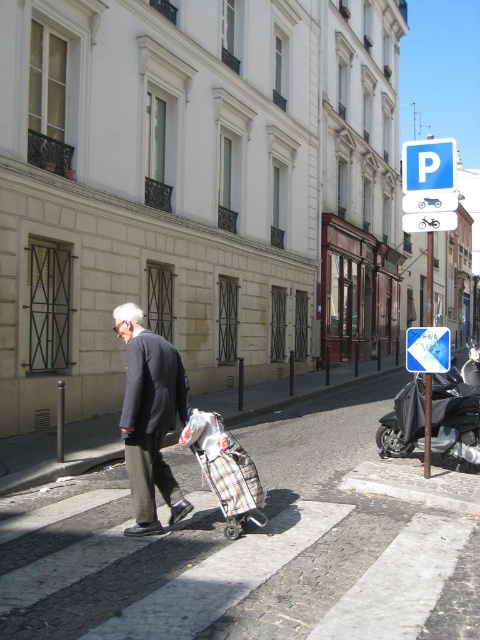
Who is higher up, blue plastic parking sign at upper right or blue plastic arrow at upper right?

blue plastic parking sign at upper right is higher up.

The width and height of the screenshot is (480, 640). Find the location of `blue plastic parking sign at upper right`. blue plastic parking sign at upper right is located at coordinates (429, 164).

At what (x,y) coordinates should I click in order to perform the action: click on blue plastic parking sign at upper right. Please return your answer as a coordinate pair (x, y). The height and width of the screenshot is (640, 480). Looking at the image, I should click on (429, 164).

Does white paved crosswalk at center have a smaller size compared to blue plastic parking sign at upper right?

Yes.

Find the location of a particular element. The width and height of the screenshot is (480, 640). white paved crosswalk at center is located at coordinates (255, 545).

Image resolution: width=480 pixels, height=640 pixels. Find the location of `white paved crosswalk at center`. white paved crosswalk at center is located at coordinates (255, 545).

The image size is (480, 640). In order to click on white paved crosswalk at center in this screenshot , I will do `click(255, 545)`.

Is point (132, 570) more distant than point (137, 358)?

No, it is in front of (137, 358).

Is point (312, 435) closer to viewer compared to point (151, 524)?

No, (312, 435) is further to viewer.

At what (x,y) coordinates should I click in order to perform the action: click on white paved crosswalk at center. Please return your answer as a coordinate pair (x, y). Looking at the image, I should click on (255, 545).